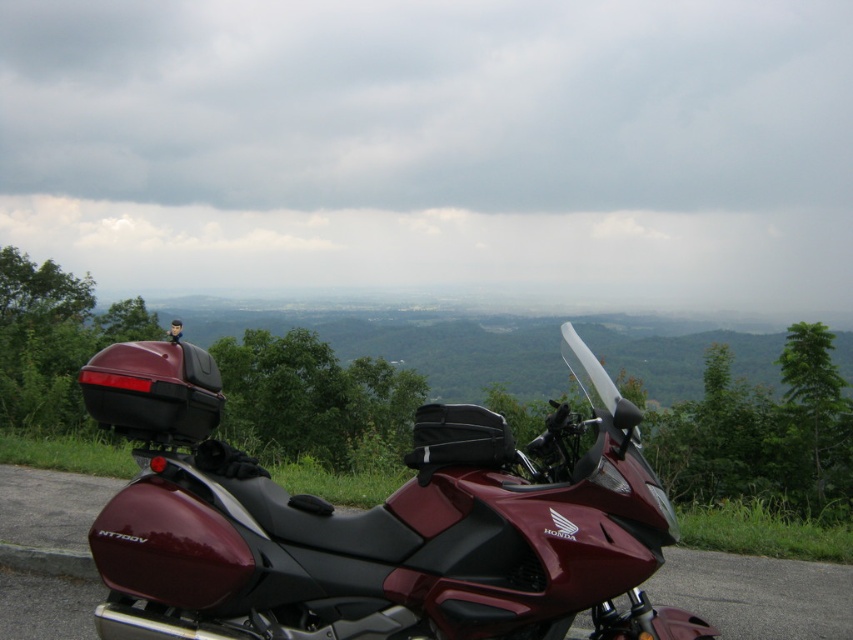
Between point (422, 532) and point (767, 580), which one is positioned behind?

The point (767, 580) is more distant.

You are a GUI agent. You are given a task and a screenshot of the screen. Output one action in this format:
    pyautogui.click(x=<x>, y=<y>)
    Task: Click on the maroon matte motorcycle at center
    
    Given the screenshot: What is the action you would take?
    tap(376, 524)